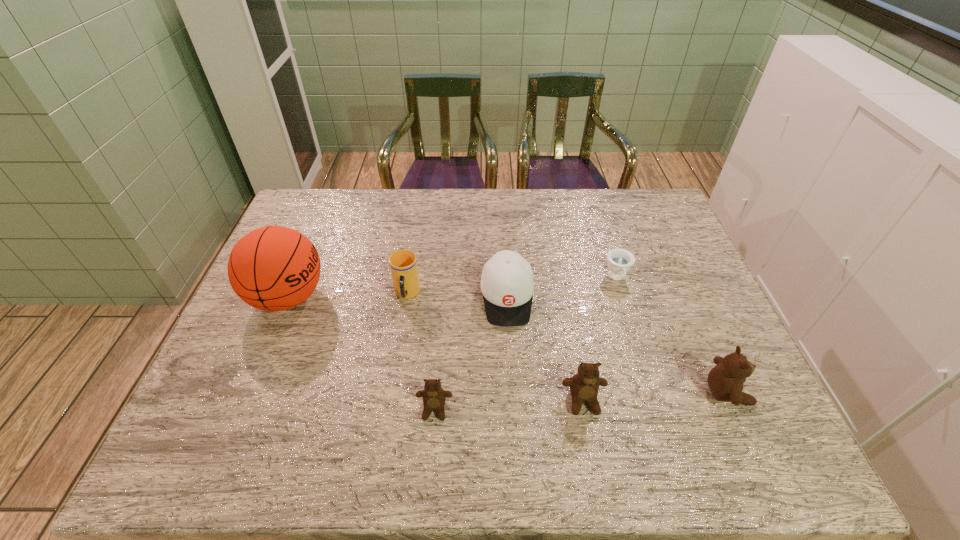
Given the evenly spaced teddy bears in the image, where should an extra teddy bear be added on the left to preserve the spacing? Please point to a vacant space. Please provide its 2D coordinates. Your answer should be formatted as a tuple, i.e. [(x, y)], where the tuple contains the x and y coordinates of a point satisfying the conditions above.

[(281, 417)]